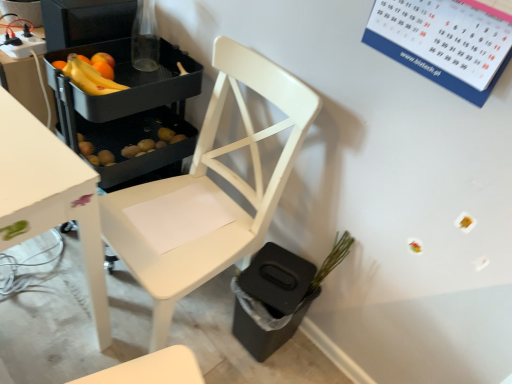
Question: From the image's perspective, is matte black tray at upper left located beneath yellow matte bananas at upper left?

Choices:
 (A) no
 (B) yes

Answer: (A)

Question: From the image's perspective, is matte black tray at upper left located above yellow matte bananas at upper left?

Choices:
 (A) yes
 (B) no

Answer: (A)

Question: Is matte black tray at upper left to the left of yellow matte bananas at upper left from the viewer's perspective?

Choices:
 (A) no
 (B) yes

Answer: (B)

Question: Does matte black tray at upper left lie behind yellow matte bananas at upper left?

Choices:
 (A) yes
 (B) no

Answer: (A)

Question: Does matte black tray at upper left have a larger size compared to yellow matte bananas at upper left?

Choices:
 (A) yes
 (B) no

Answer: (A)

Question: Considering their positions, is matte black tray at upper left located in front of or behind white wood chair at center?

Choices:
 (A) front
 (B) behind

Answer: (B)

Question: Based on their positions, is matte black tray at upper left located to the left or right of white wood chair at center?

Choices:
 (A) left
 (B) right

Answer: (A)

Question: Does point (70, 3) appear closer or farther from the camera than point (221, 206)?

Choices:
 (A) farther
 (B) closer

Answer: (B)

Question: From the image's perspective, relative to white wood chair at center, is matte black tray at upper left above or below?

Choices:
 (A) below
 (B) above

Answer: (B)

Question: Is green matte plant at lower right taller or shorter than white wood chair at center?

Choices:
 (A) tall
 (B) short

Answer: (B)

Question: From a real-world perspective, is green matte plant at lower right physically located above or below white wood chair at center?

Choices:
 (A) below
 (B) above

Answer: (A)

Question: Which is correct: green matte plant at lower right is inside white wood chair at center, or outside of it?

Choices:
 (A) inside
 (B) outside

Answer: (B)

Question: Considering their positions, is green matte plant at lower right located in front of or behind white wood chair at center?

Choices:
 (A) behind
 (B) front

Answer: (A)

Question: Is white wood chair at center wider or thinner than yellow matte bananas at upper left?

Choices:
 (A) thin
 (B) wide

Answer: (B)

Question: Do you think white wood chair at center is within yellow matte bananas at upper left, or outside of it?

Choices:
 (A) outside
 (B) inside

Answer: (A)